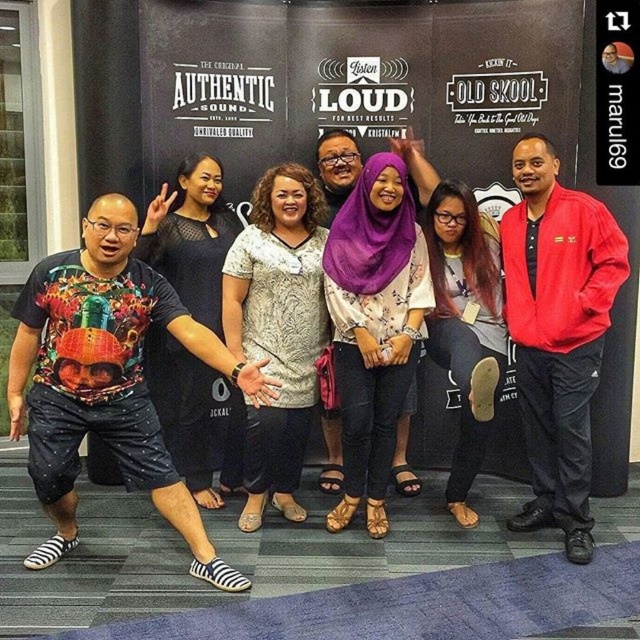
Question: Can you confirm if red polyester jacket at right is positioned to the right of purple floral blouse at center?

Choices:
 (A) no
 (B) yes

Answer: (B)

Question: Which object is farther from the camera taking this photo?

Choices:
 (A) printed fabric blouse at center
 (B) printed cotton t-shirt at left
 (C) purple floral blouse at center

Answer: (A)

Question: Is printed cotton t-shirt at left thinner than red polyester jacket at right?

Choices:
 (A) no
 (B) yes

Answer: (A)

Question: Which point is closer to the camera?

Choices:
 (A) purple fabric hijab at center
 (B) red polyester jacket at right
 (C) printed fabric blouse at center
 (D) printed cotton t-shirt at left

Answer: (D)

Question: Which point is farther from the camera taking this photo?

Choices:
 (A) (205, 176)
 (B) (436, 284)

Answer: (A)

Question: Does black mesh dress at center appear under purple fabric hijab at center?

Choices:
 (A) no
 (B) yes

Answer: (B)